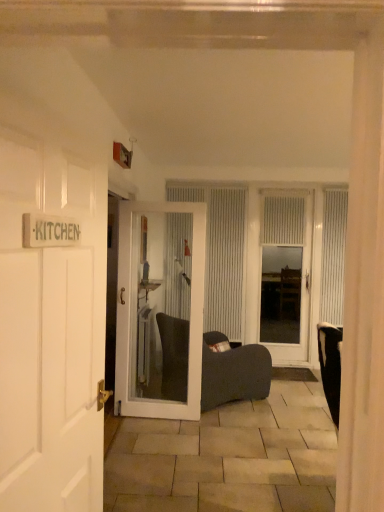
At what (x,y) coordinates should I click in order to perform the action: click on free space to the right of dark fabric chair at center. Please return your answer as a coordinate pair (x, y). Looking at the image, I should click on (284, 403).